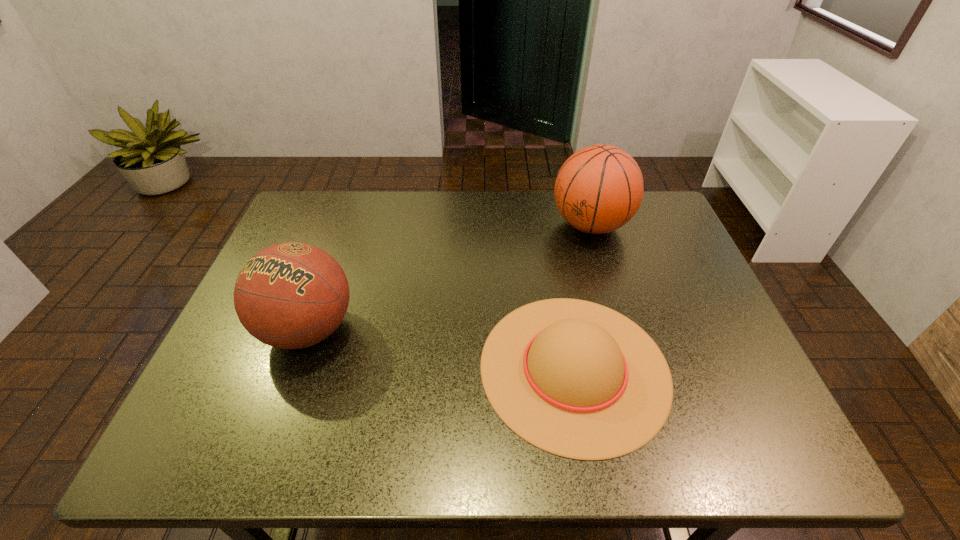
You are a GUI agent. You are given a task and a screenshot of the screen. Output one action in this format:
    pyautogui.click(x=<x>, y=<y>)
    Task: Click on the right basketball
    The image size is (960, 540).
    Given the screenshot: What is the action you would take?
    pyautogui.click(x=599, y=188)

Locate an element on the screen. the farther basketball is located at coordinates 599,188.

Image resolution: width=960 pixels, height=540 pixels. What are the coordinates of `the nearer basketball` in the screenshot? It's located at (291, 295).

You are a GUI agent. You are given a task and a screenshot of the screen. Output one action in this format:
    pyautogui.click(x=<x>, y=<y>)
    Task: Click on the leftmost object
    This screenshot has width=960, height=540.
    Given the screenshot: What is the action you would take?
    pyautogui.click(x=291, y=295)

The image size is (960, 540). Find the location of `sombrero`. sombrero is located at coordinates (x=576, y=379).

What are the coordinates of `free space located on the front of the farther basketball` in the screenshot? It's located at (611, 292).

This screenshot has height=540, width=960. Find the location of `vacant space located on the right of the leftmost object`. vacant space located on the right of the leftmost object is located at coordinates (416, 329).

This screenshot has height=540, width=960. Identify the location of vacant space located 0.050m on the left of the shortest object. (458, 368).

Locate an element on the screen. The image size is (960, 540). object at the far edge is located at coordinates (599, 188).

The width and height of the screenshot is (960, 540). Identify the location of object at the near edge. (576, 379).